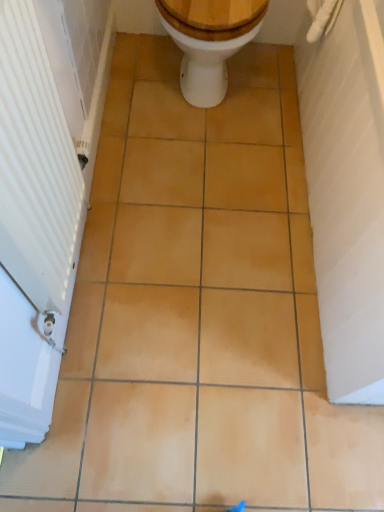
Image resolution: width=384 pixels, height=512 pixels. What do you see at coordinates (209, 41) in the screenshot? I see `white glossy toilet at center` at bounding box center [209, 41].

The image size is (384, 512). Identify the location of white glossy toilet at center. (209, 41).

Where is `white ribbed radiator at left`? white ribbed radiator at left is located at coordinates (33, 227).

This screenshot has width=384, height=512. What do you see at coordinates (33, 227) in the screenshot?
I see `white ribbed radiator at left` at bounding box center [33, 227].

Where is `white glossy toilet at center`? This screenshot has height=512, width=384. white glossy toilet at center is located at coordinates (209, 41).

Between white ribbed radiator at left and white glossy toilet at center, which one appears on the left side from the viewer's perspective?

white ribbed radiator at left.

Consider the image. Is white ribbed radiator at left further to the viewer compared to white glossy toilet at center?

That is False.

Which is behind, point (51, 100) or point (202, 74)?

Point (202, 74)

From the image's perspective, between white ribbed radiator at left and white glossy toilet at center, which one is located above?

From the image's view, white glossy toilet at center is above.

From a real-world perspective, which object stands above the other?

In real-world perspective, white ribbed radiator at left is above.

Between white ribbed radiator at left and white glossy toilet at center, which one has smaller width?

white ribbed radiator at left.

Does white ribbed radiator at left have a lesser height compared to white glossy toilet at center?

In fact, white ribbed radiator at left may be taller than white glossy toilet at center.

Is white ribbed radiator at left smaller than white glossy toilet at center?

Yes, white ribbed radiator at left is smaller than white glossy toilet at center.

Is white glossy toilet at center surrounded by white ribbed radiator at left?

No, white glossy toilet at center is located outside of white ribbed radiator at left.

Is white ribbed radiator at left positioned far away from white glossy toilet at center?

No, white ribbed radiator at left is not far away from white glossy toilet at center.

Is white ribbed radiator at left facing away from white glossy toilet at center?

white ribbed radiator at left does not have its back to white glossy toilet at center.

Identify the location of toilet directly beneath the white ribbed radiator at left (from a real-world perspective). (209, 41).

Is white glossy toilet at center at the left side of white ribbed radiator at left?

Incorrect, white glossy toilet at center is not on the left side of white ribbed radiator at left.

Considering their positions, is white glossy toilet at center located in front of or behind white ribbed radiator at left?

white glossy toilet at center is positioned farther from the viewer than white ribbed radiator at left.

Which is less distant, (194, 81) or (5, 75)?

The point (5, 75) is in front.

From the image's perspective, would you say white glossy toilet at center is positioned over white ribbed radiator at left?

Yes, from the image's perspective, white glossy toilet at center is over white ribbed radiator at left.

From a real-world perspective, between white glossy toilet at center and white ribbed radiator at left, who is vertically lower?

From a 3D spatial view, white glossy toilet at center is below.

Is white glossy toilet at center wider or thinner than white ribbed radiator at left?

Considering their sizes, white glossy toilet at center looks broader than white ribbed radiator at left.

Which of these two, white glossy toilet at center or white ribbed radiator at left, stands taller?

With more height is white ribbed radiator at left.

Looking at this image, is white glossy toilet at center bigger or smaller than white ribbed radiator at left?

In the image, white glossy toilet at center appears to be larger than white ribbed radiator at left.

Is white glossy toilet at center outside of white ribbed radiator at left?

Yes, white glossy toilet at center is not within white ribbed radiator at left.

Are white glossy toilet at center and white ribbed radiator at left beside each other?

They are not placed beside each other.

Is white glossy toilet at center turned away from white ribbed radiator at left?

white glossy toilet at center does not have its back to white ribbed radiator at left.

Can you tell me how much white glossy toilet at center and white ribbed radiator at left differ in facing direction?

The facing directions of white glossy toilet at center and white ribbed radiator at left are 89.1 degrees apart.

This screenshot has width=384, height=512. I want to click on screen door that is in front of the white glossy toilet at center, so click(33, 227).

This screenshot has height=512, width=384. Identify the location of screen door on the left of white glossy toilet at center. (33, 227).

Find the location of a particular element. screen door that is below the white glossy toilet at center (from the image's perspective) is located at coordinates (33, 227).